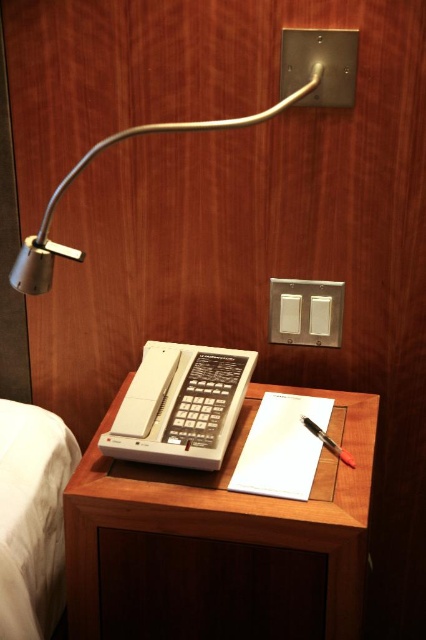
Question: Which object is closer to the camera taking this photo?

Choices:
 (A) black plastic pen at center
 (B) wooden table at center

Answer: (B)

Question: Is white plastic phone at center positioned behind satin silver lamp at upper center?

Choices:
 (A) no
 (B) yes

Answer: (B)

Question: Does wooden table at center have a larger size compared to white plastic phone at center?

Choices:
 (A) no
 (B) yes

Answer: (B)

Question: Among these objects, which one is farthest from the camera?

Choices:
 (A) satin silver lamp at upper center
 (B) white plastic phone at center
 (C) wooden table at center

Answer: (B)

Question: Estimate the real-world distances between objects in this image. Which object is closer to the black plastic pen at center?

Choices:
 (A) white fabric bed at lower left
 (B) wooden table at center
 (C) white plastic phone at center
 (D) satin silver lamp at upper center

Answer: (C)

Question: Can you confirm if white fabric bed at lower left is smaller than black plastic pen at center?

Choices:
 (A) no
 (B) yes

Answer: (A)